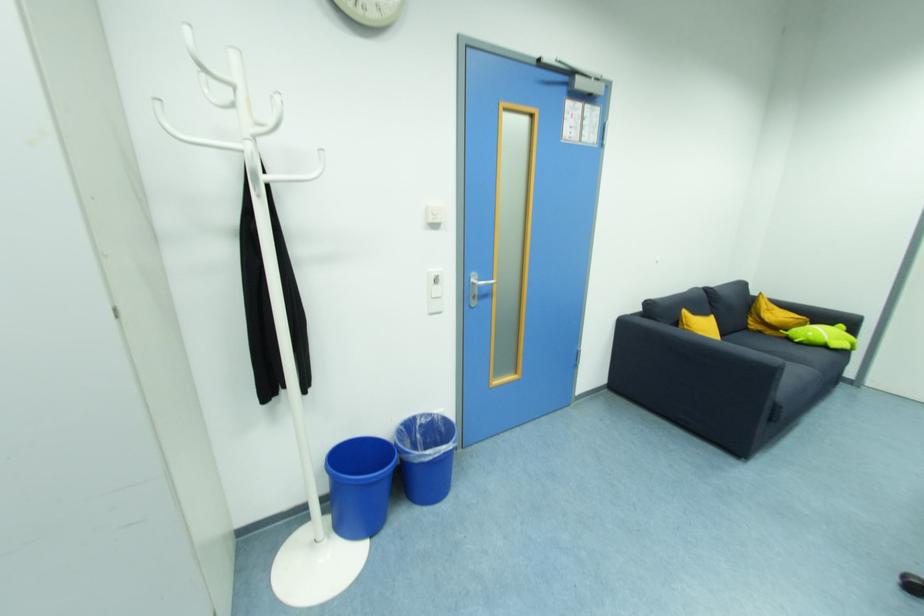
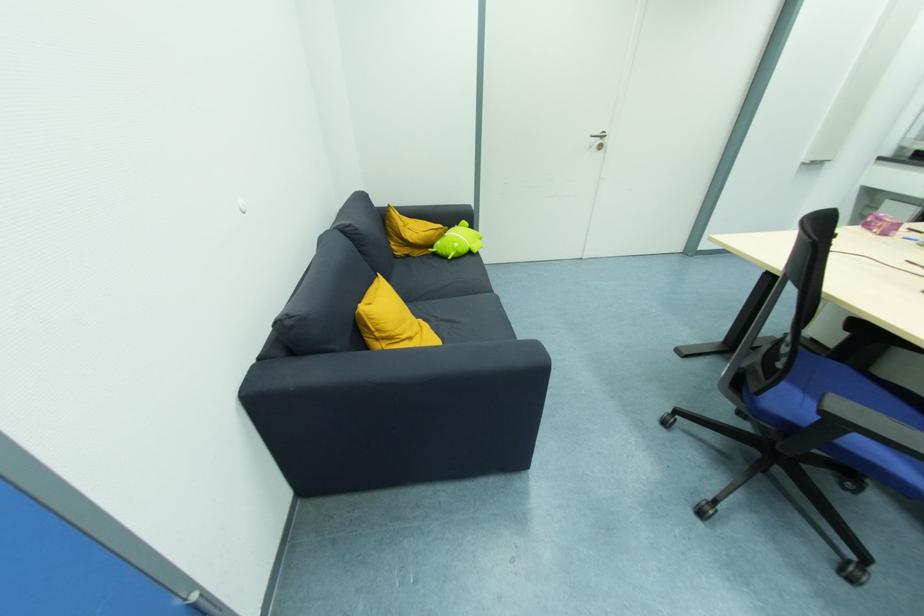
Find the pixel in the second image that matches (x=757, y=328) in the first image.

(403, 253)